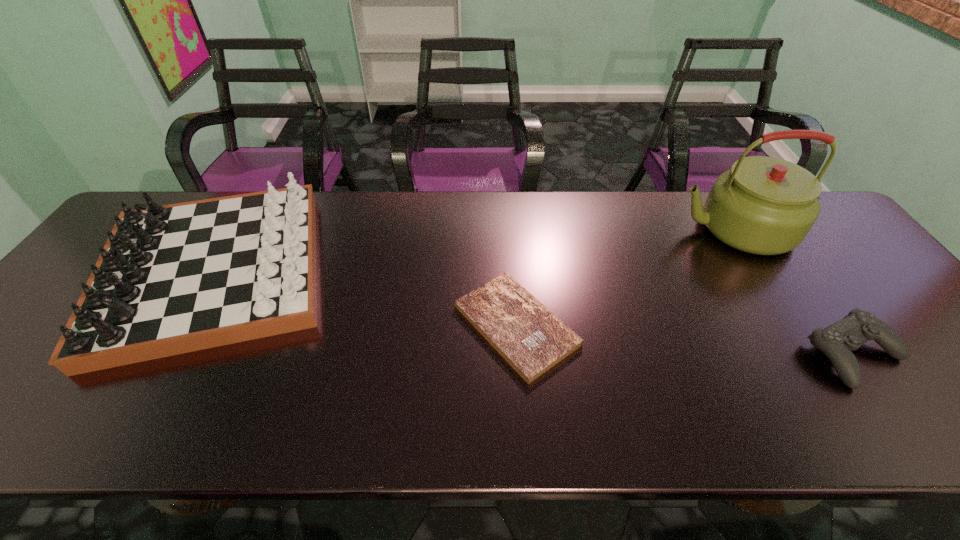
Image resolution: width=960 pixels, height=540 pixels. Find the location of `vacant space that is in between the kettle and the control`. vacant space that is in between the kettle and the control is located at coordinates (x=793, y=292).

Identify the location of empty location between the tallest object and the control. (793, 292).

Identify which object is the nearest to the second tallest object. Please provide its 2D coordinates. Your answer should be formatted as a tuple, i.e. [(x, y)], where the tuple contains the x and y coordinates of a point satisfying the conditions above.

[(532, 340)]

Select which object appears as the second closest to the leftmost object. Please provide its 2D coordinates. Your answer should be formatted as a tuple, i.e. [(x, y)], where the tuple contains the x and y coordinates of a point satisfying the conditions above.

[(763, 205)]

Locate an element on the screen. blank area in the image that satisfies the following two spatial constraints: 1. at the spout of the kettle; 2. on the left side of the control is located at coordinates (810, 354).

Where is `vacant space that satisfies the following two spatial constraints: 1. at the spout of the kettle; 2. on the right side of the third tallest object`? The height and width of the screenshot is (540, 960). vacant space that satisfies the following two spatial constraints: 1. at the spout of the kettle; 2. on the right side of the third tallest object is located at coordinates (810, 354).

Image resolution: width=960 pixels, height=540 pixels. Find the location of `vacant space that satisfies the following two spatial constraints: 1. at the spout of the control; 2. on the left side of the kettle`. vacant space that satisfies the following two spatial constraints: 1. at the spout of the control; 2. on the left side of the kettle is located at coordinates (810, 354).

What are the coordinates of `free space that satisfies the following two spatial constraints: 1. on the front side of the Bible; 2. on the left side of the third tallest object` in the screenshot? It's located at pos(517,354).